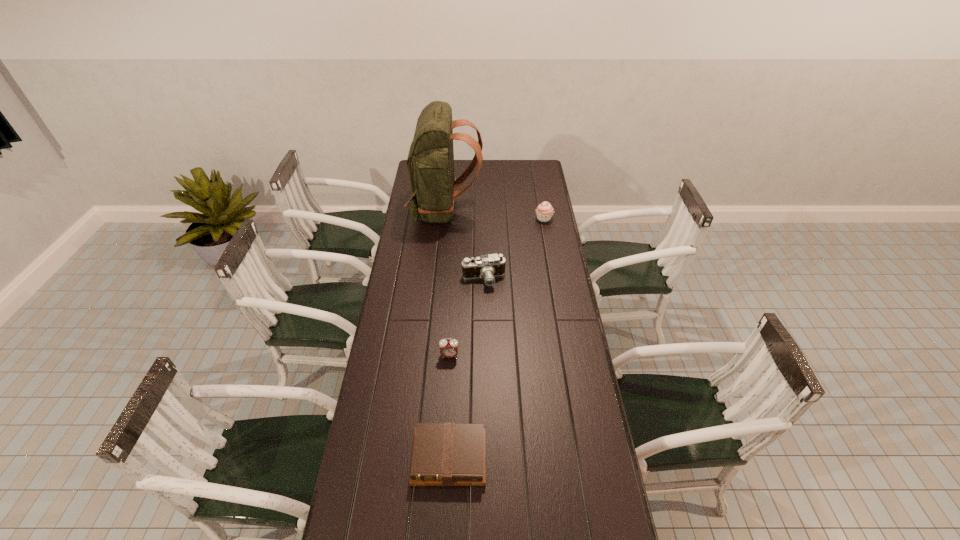
Where is `free space between the camera and the alarm clock`? The height and width of the screenshot is (540, 960). free space between the camera and the alarm clock is located at coordinates (467, 318).

At what (x,y) coordinates should I click in order to perform the action: click on free spot between the Bible and the cupcake. Please return your answer as a coordinate pair (x, y). The width and height of the screenshot is (960, 540). Looking at the image, I should click on (496, 339).

I want to click on free space that is in between the tallest object and the cupcake, so click(494, 214).

This screenshot has height=540, width=960. I want to click on object that stands as the closest to the shortest object, so click(448, 348).

You are a GUI agent. You are given a task and a screenshot of the screen. Output one action in this format:
    pyautogui.click(x=<x>, y=<y>)
    Task: Click on the closest object relative to the third nearest object
    This screenshot has width=960, height=540.
    Given the screenshot: What is the action you would take?
    pyautogui.click(x=430, y=162)